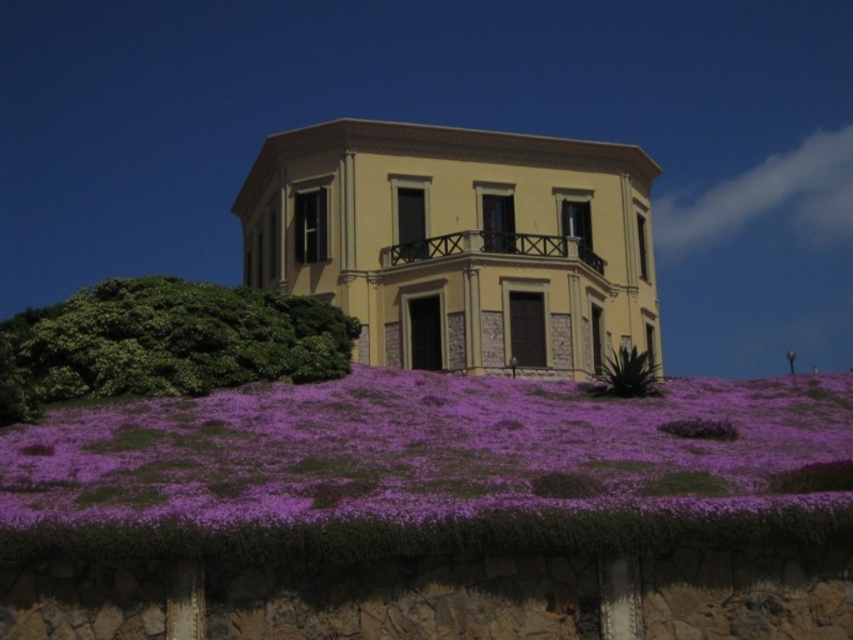
You are planning to plant a new flower bed between the purple soft grass at lower center and the green spiky plant at lower right. Which area has more space available for planting?

The purple soft grass at lower center has a larger width than the green spiky plant at lower right, so there is more space available for planting in the area of the purple soft grass at lower center.

You are a gardener planning to plant a new flower bed between the purple soft grass at lower center and the green spiky plant at lower right. Which of the two plants should you place the new flower bed closer to if you want it to be at the same height as the taller plant?

You should place the new flower bed closer to the green spiky plant at lower right because it is taller than the purple soft grass at lower center.